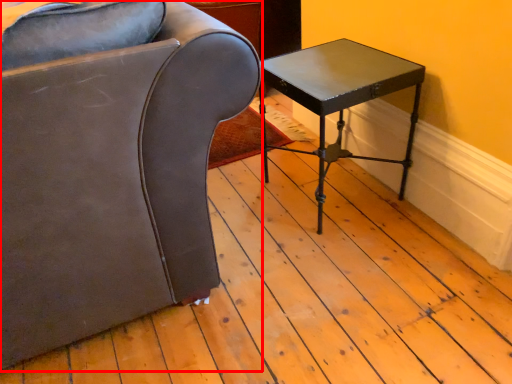
Question: From the image's perspective, considering the relative positions of chair (annotated by the red box) and table in the image provided, where is chair (annotated by the red box) located with respect to the staircase?

Choices:
 (A) below
 (B) above

Answer: (B)